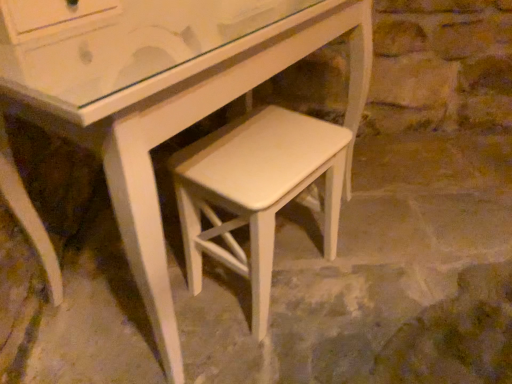
What do you see at coordinates (217, 152) in the screenshot? I see `white painted wood stool at center` at bounding box center [217, 152].

The width and height of the screenshot is (512, 384). I want to click on white painted wood stool at center, so click(x=217, y=152).

The width and height of the screenshot is (512, 384). Find the location of `white matte stool at center`. white matte stool at center is located at coordinates (256, 191).

The image size is (512, 384). What do you see at coordinates (256, 191) in the screenshot?
I see `white matte stool at center` at bounding box center [256, 191].

What is the approximate width of white matte stool at center?

white matte stool at center is 30.24 centimeters in width.

Find the location of a particular element. Image resolution: width=512 pixels, height=384 pixels. white painted wood stool at center is located at coordinates (217, 152).

From the picture: Which object is positioned more to the right, white matte stool at center or white painted wood stool at center?

Positioned to the right is white painted wood stool at center.

Who is more distant, white matte stool at center or white painted wood stool at center?

white painted wood stool at center.

Between point (212, 158) and point (113, 9), which one is positioned behind?

The point (212, 158) is more distant.

From the image's perspective, which object appears higher, white matte stool at center or white painted wood stool at center?

white matte stool at center is shown above in the image.

From a real-world perspective, does white matte stool at center sit lower than white painted wood stool at center?

No.

Between white matte stool at center and white painted wood stool at center, which one has smaller width?

white matte stool at center is thinner.

Considering the relative sizes of white matte stool at center and white painted wood stool at center in the image provided, is white matte stool at center shorter than white painted wood stool at center?

Incorrect, the height of white matte stool at center does not fall short of that of white painted wood stool at center.

Is white matte stool at center bigger than white painted wood stool at center?

No, white matte stool at center is not bigger than white painted wood stool at center.

In the scene shown: Is white matte stool at center not inside white painted wood stool at center?

Yes, white matte stool at center is outside of white painted wood stool at center.

Is white matte stool at center not close to white painted wood stool at center?

white matte stool at center is near white painted wood stool at center, not far away.

Is white matte stool at center oriented away from white painted wood stool at center?

No, white matte stool at center's orientation is not away from white painted wood stool at center.

Can you tell me how much white matte stool at center and white painted wood stool at center differ in facing direction?

41.6 degrees.

Locate an element on the screen. Image resolution: width=512 pixels, height=384 pixels. table below the white matte stool at center (from a real-world perspective) is located at coordinates (217, 152).

Visually, is white painted wood stool at center positioned to the left or to the right of white matte stool at center?

Based on their positions, white painted wood stool at center is located to the right of white matte stool at center.

Considering their positions, is white painted wood stool at center located in front of or behind white matte stool at center?

Visually, white painted wood stool at center is located behind white matte stool at center.

Is point (307, 174) closer to camera compared to point (199, 228)?

Yes, it is.

From the image's perspective, would you say white painted wood stool at center is positioned over white matte stool at center?

No, from the image's perspective, white painted wood stool at center is not over white matte stool at center.

From a real-world perspective, is white painted wood stool at center located beneath white matte stool at center?

Yes, from a real-world perspective, white painted wood stool at center is beneath white matte stool at center.

Between white painted wood stool at center and white matte stool at center, which one has larger width?

white painted wood stool at center.

Which of these two, white painted wood stool at center or white matte stool at center, stands shorter?

Standing shorter between the two is white painted wood stool at center.

In terms of size, does white painted wood stool at center appear bigger or smaller than white matte stool at center?

white painted wood stool at center is bigger than white matte stool at center.

Is white matte stool at center located within white painted wood stool at center?

No.

Are white painted wood stool at center and white matte stool at center located far from each other?

That's not correct — white painted wood stool at center is a little close to white matte stool at center.

Is white matte stool at center at the back of white painted wood stool at center?

That's not correct — white painted wood stool at center is not looking away from white matte stool at center.

Can you tell me how much white painted wood stool at center and white matte stool at center differ in facing direction?

They differ by 41.6 degrees in their facing directions.

Find the location of `stool that is above the white painted wood stool at center (from the image's perspective)`. stool that is above the white painted wood stool at center (from the image's perspective) is located at coordinates (256, 191).

Identify the location of stool above the white painted wood stool at center (from a real-world perspective). (256, 191).

Identify the location of table that is on the right side of white matte stool at center. Image resolution: width=512 pixels, height=384 pixels. (217, 152).